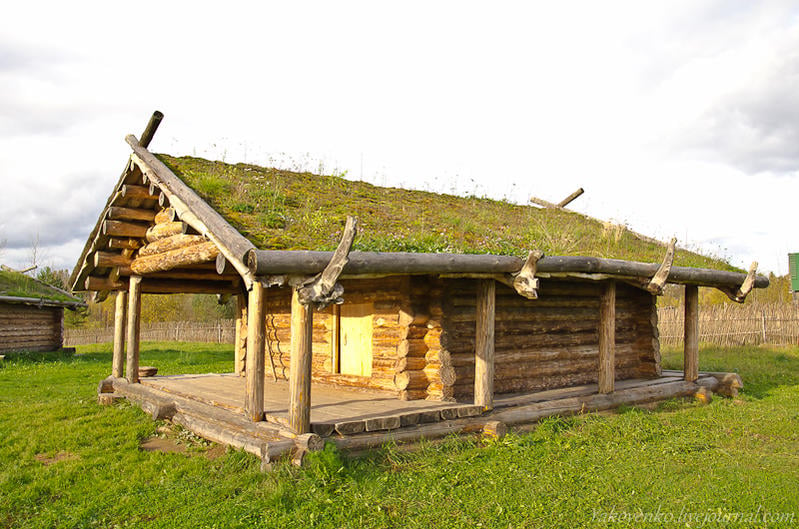
The height and width of the screenshot is (529, 799). In order to click on door in this screenshot , I will do `click(356, 341)`.